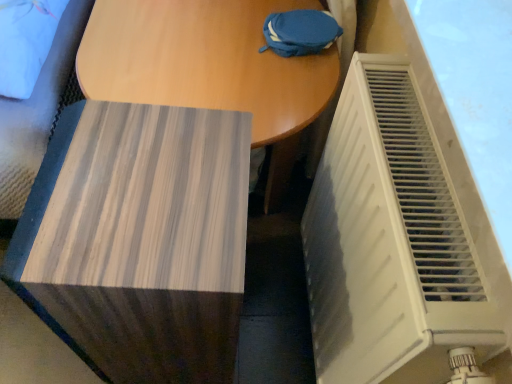
Question: Is wooden table at center in contact with wooden side table at lower left?

Choices:
 (A) yes
 (B) no

Answer: (B)

Question: Can you confirm if wooden table at center is taller than wooden side table at lower left?

Choices:
 (A) no
 (B) yes

Answer: (A)

Question: Is wooden table at center positioned with its back to wooden side table at lower left?

Choices:
 (A) yes
 (B) no

Answer: (B)

Question: Does wooden table at center have a greater width compared to wooden side table at lower left?

Choices:
 (A) no
 (B) yes

Answer: (B)

Question: Does wooden table at center have a lesser height compared to wooden side table at lower left?

Choices:
 (A) yes
 (B) no

Answer: (A)

Question: Is wooden side table at lower left to the left or to the right of wooden table at center in the image?

Choices:
 (A) right
 (B) left

Answer: (B)

Question: Is wooden side table at lower left in front of or behind wooden table at center in the image?

Choices:
 (A) behind
 (B) front

Answer: (B)

Question: In terms of height, does wooden side table at lower left look taller or shorter compared to wooden table at center?

Choices:
 (A) short
 (B) tall

Answer: (B)

Question: In terms of size, does wooden side table at lower left appear bigger or smaller than wooden table at center?

Choices:
 (A) small
 (B) big

Answer: (A)

Question: Is wooden table at center in front of or behind wooden side table at lower left in the image?

Choices:
 (A) behind
 (B) front

Answer: (A)

Question: Choose the correct answer: Is wooden table at center inside wooden side table at lower left or outside it?

Choices:
 (A) outside
 (B) inside

Answer: (A)

Question: Considering the positions of wooden table at center and wooden side table at lower left in the image, is wooden table at center bigger or smaller than wooden side table at lower left?

Choices:
 (A) small
 (B) big

Answer: (B)

Question: From a real-world perspective, is wooden table at center physically located above or below wooden side table at lower left?

Choices:
 (A) above
 (B) below

Answer: (B)

Question: From a real-world perspective, is wooden table at center physically located above or below white plastic radiator at right?

Choices:
 (A) above
 (B) below

Answer: (B)

Question: Is wooden table at center to the left or to the right of white plastic radiator at right in the image?

Choices:
 (A) right
 (B) left

Answer: (B)